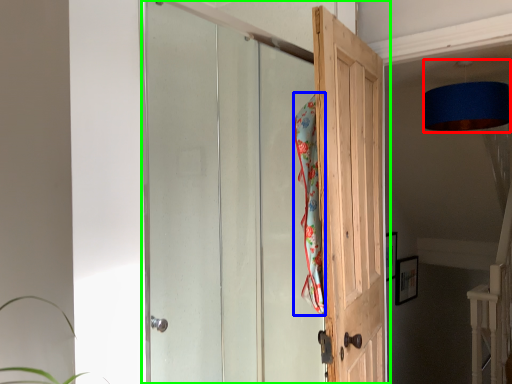
Question: Based on their relative distances, which object is nearer to lamp (highlighted by a red box)? Choose from beach towel (highlighted by a blue box) and door (highlighted by a green box).

Choices:
 (A) beach towel
 (B) door

Answer: (A)